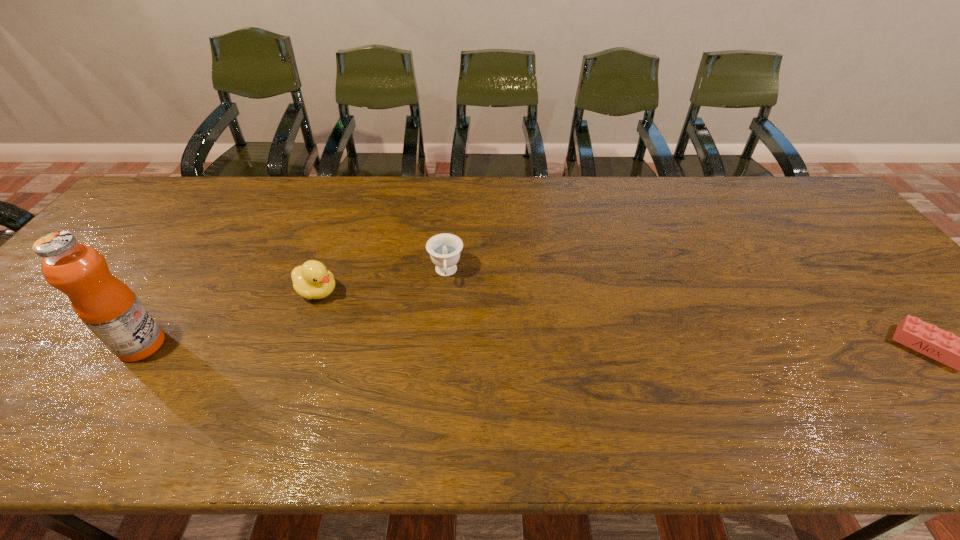
Identify the location of vacant space located on the side of the second object from right to left with the handle. (446, 307).

Locate an element on the screen. The width and height of the screenshot is (960, 540). free space located on the side of the second object from right to left with the handle is located at coordinates (446, 304).

Find the location of a particular element. This screenshot has width=960, height=540. vacant space located on the side of the second object from right to left with the handle is located at coordinates (447, 349).

At what (x,y) coordinates should I click in order to perform the action: click on object situated at the near edge. Please return your answer as a coordinate pair (x, y). Looking at the image, I should click on (109, 308).

In the image, there is a desktop. At what (x,y) coordinates should I click in order to perform the action: click on free space at the far edge. Please return your answer as a coordinate pair (x, y). The height and width of the screenshot is (540, 960). Looking at the image, I should click on (746, 178).

Image resolution: width=960 pixels, height=540 pixels. In order to click on free spot at the near edge of the desktop in this screenshot , I will do `click(576, 366)`.

Locate an element on the screen. Image resolution: width=960 pixels, height=540 pixels. vacant area at the right edge of the desktop is located at coordinates (812, 233).

The height and width of the screenshot is (540, 960). In order to click on vacant space at the far right corner of the desktop in this screenshot , I will do `click(754, 178)`.

Find the location of a particular element. This screenshot has width=960, height=540. vacant space at the near right corner of the desktop is located at coordinates (945, 373).

What are the coordinates of `free space between the teacup and the leftmost object` in the screenshot? It's located at (294, 309).